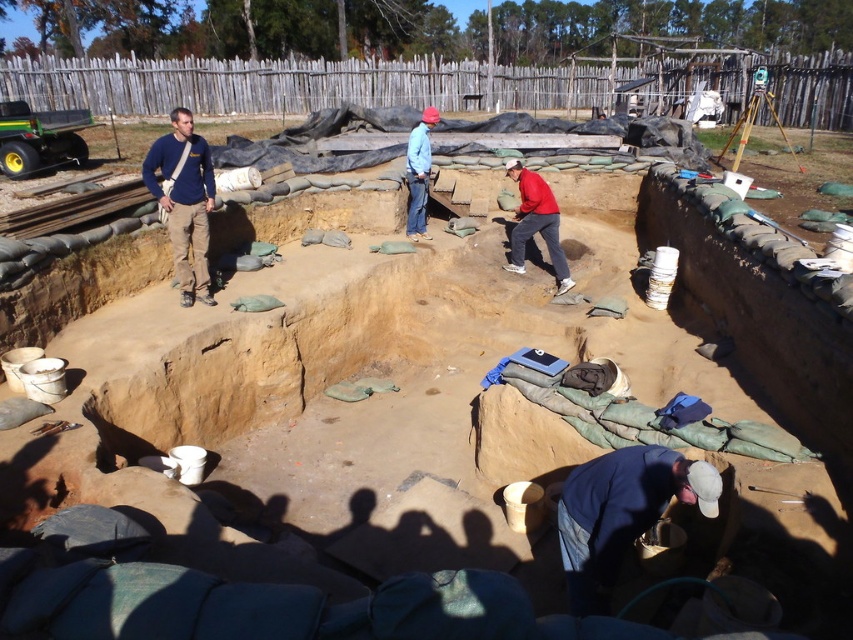
Question: Does blue cotton shirt at upper left appear under red matte jacket at center?

Choices:
 (A) yes
 (B) no

Answer: (A)

Question: Which object is farther from the camera taking this photo?

Choices:
 (A) blue denim jacket at lower right
 (B) blue cotton shirt at upper left

Answer: (B)

Question: Does blue denim jacket at lower right appear under blue cotton shirt at upper left?

Choices:
 (A) yes
 (B) no

Answer: (A)

Question: Which of the following is the closest to the observer?

Choices:
 (A) blue cotton shirt at upper left
 (B) red matte jacket at center
 (C) blue denim jacket at lower right

Answer: (C)

Question: Is blue denim jacket at lower right above blue cotton shirt at upper left?

Choices:
 (A) no
 (B) yes

Answer: (A)

Question: Among these points, which one is nearest to the camera?

Choices:
 (A) (180, 214)
 (B) (519, 193)
 (C) (630, 484)

Answer: (C)